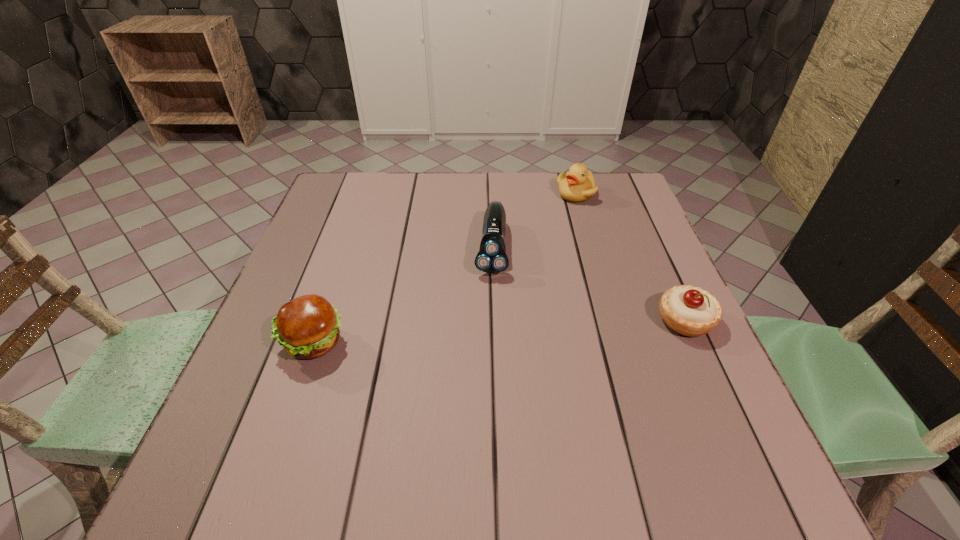
Where is `hamburger`? This screenshot has width=960, height=540. hamburger is located at coordinates (307, 327).

This screenshot has height=540, width=960. Identify the location of pastry. (690, 311).

Locate an element on the screen. Image resolution: width=960 pixels, height=540 pixels. the third object from right to left is located at coordinates (492, 258).

Where is `the second farthest object`? The image size is (960, 540). the second farthest object is located at coordinates (492, 258).

This screenshot has height=540, width=960. I want to click on the farthest object, so click(578, 184).

What are the coordinates of `duckling` in the screenshot? It's located at tap(578, 184).

Identify the location of vacant area situated 0.230m on the back of the hamburger. (346, 250).

This screenshot has height=540, width=960. I want to click on vacant space located on the back of the rightmost object, so click(x=666, y=279).

Locate an element on the screen. This screenshot has height=540, width=960. vacant space located 0.290m on the head of the electric shaver is located at coordinates (483, 386).

Locate an element on the screen. This screenshot has height=540, width=960. vacant region located 0.100m on the head of the electric shaver is located at coordinates (488, 312).